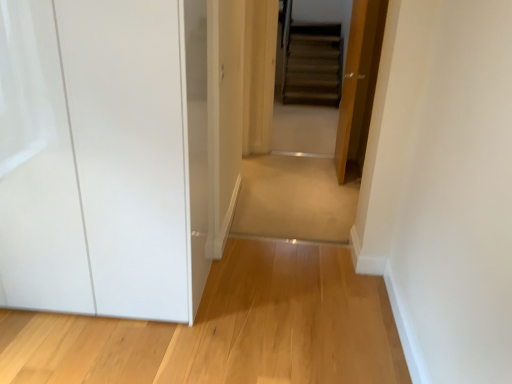
The height and width of the screenshot is (384, 512). Describe the element at coordinates (294, 199) in the screenshot. I see `beige carpet at center, positioned as the second path in front-to-back order` at that location.

The width and height of the screenshot is (512, 384). What are the coordinates of `wooden door at center` in the screenshot? It's located at (359, 86).

I want to click on door above the light wood floor at lower left, the second path viewed from the top (from a real-world perspective), so click(359, 86).

How far apart are wooden door at center and light wood floor at lower left, which is counted as the 1th path, starting from the front?

6.96 feet.

Is wooden door at center situated inside light wood floor at lower left, acting as the first path starting from the bottom, or outside?

wooden door at center is outside light wood floor at lower left, acting as the first path starting from the bottom.

What's the angular difference between wooden door at center and light wood floor at lower left, which is counted as the 1th path, starting from the front,'s facing directions?

86.2 degrees separate the facing orientations of wooden door at center and light wood floor at lower left, which is counted as the 1th path, starting from the front.

Which is more to the left, beige carpet at center, which ranks as the first path in back-to-front order, or light wood floor at lower left, acting as the first path starting from the bottom?

Positioned to the left is light wood floor at lower left, acting as the first path starting from the bottom.

Is light wood floor at lower left, the second path viewed from the top, located within beige carpet at center, which ranks as the 1th path in top-to-bottom order?

No, beige carpet at center, which ranks as the 1th path in top-to-bottom order, does not contain light wood floor at lower left, the second path viewed from the top.

Which object is closer to the camera, beige carpet at center, which is counted as the second path, starting from the bottom, or light wood floor at lower left, which is the second path in back-to-front order?

light wood floor at lower left, which is the second path in back-to-front order.

The height and width of the screenshot is (384, 512). In order to click on glass door located above the beige carpet at center, which ranks as the first path in back-to-front order (from the image's perspective) in this screenshot , I will do `click(106, 166)`.

Considering the sizes of beige carpet at center, positioned as the second path in front-to-back order, and transparent glossy cabinet at left in the image, is beige carpet at center, positioned as the second path in front-to-back order, taller or shorter than transparent glossy cabinet at left?

Considering their sizes, beige carpet at center, positioned as the second path in front-to-back order, has less height than transparent glossy cabinet at left.

From the picture: Is beige carpet at center, which is counted as the second path, starting from the bottom, far from transparent glossy cabinet at left?

beige carpet at center, which is counted as the second path, starting from the bottom, is far away from transparent glossy cabinet at left.

Does point (340, 239) appear closer or farther from the camera than point (56, 122)?

Clearly, point (340, 239) is more distant from the camera than point (56, 122).

Looking at this image, would you say light wood floor at lower left, acting as the first path starting from the bottom, contains transparent glossy cabinet at left?

Actually, transparent glossy cabinet at left is outside light wood floor at lower left, acting as the first path starting from the bottom.

In terms of size, does light wood floor at lower left, the second path viewed from the top, appear bigger or smaller than transparent glossy cabinet at left?

Clearly, light wood floor at lower left, the second path viewed from the top, is smaller in size than transparent glossy cabinet at left.

From a real-world perspective, which is physically above, beige carpet at center, positioned as the second path in front-to-back order, or wooden door at center?

wooden door at center, from a real-world perspective.

Is point (258, 169) closer or farther from the camera than point (366, 39)?

Point (258, 169) appears to be farther away from the viewer than point (366, 39).

Is beige carpet at center, which ranks as the 1th path in top-to-bottom order, at the left side of wooden door at center?

Correct, you'll find beige carpet at center, which ranks as the 1th path in top-to-bottom order, to the left of wooden door at center.

Is light wood floor at lower left, the second path viewed from the top, wider than beige carpet at center, positioned as the second path in front-to-back order?

No.

From the image's perspective, is light wood floor at lower left, which is the second path in back-to-front order, located above or below beige carpet at center, which ranks as the first path in back-to-front order?

light wood floor at lower left, which is the second path in back-to-front order, is below beige carpet at center, which ranks as the first path in back-to-front order.

Is the position of light wood floor at lower left, acting as the first path starting from the bottom, less distant than that of beige carpet at center, which is counted as the second path, starting from the bottom?

Yes, the depth of light wood floor at lower left, acting as the first path starting from the bottom, is less than that of beige carpet at center, which is counted as the second path, starting from the bottom.

Considering the sizes of objects transparent glossy cabinet at left and beige carpet at center, which ranks as the first path in back-to-front order, in the image provided, who is taller, transparent glossy cabinet at left or beige carpet at center, which ranks as the first path in back-to-front order,?

Standing taller between the two is transparent glossy cabinet at left.

In terms of size, does transparent glossy cabinet at left appear bigger or smaller than beige carpet at center, which ranks as the first path in back-to-front order?

Considering their sizes, transparent glossy cabinet at left takes up more space than beige carpet at center, which ranks as the first path in back-to-front order.

Is transparent glossy cabinet at left inside the boundaries of beige carpet at center, which ranks as the first path in back-to-front order, or outside?

transparent glossy cabinet at left cannot be found inside beige carpet at center, which ranks as the first path in back-to-front order.

Which object is positioned more to the right, transparent glossy cabinet at left or beige carpet at center, which is counted as the second path, starting from the bottom?

beige carpet at center, which is counted as the second path, starting from the bottom.

Locate an element on the screen. door lying on the right of light wood floor at lower left, which is the second path in back-to-front order is located at coordinates (359, 86).

At what (x,y) coordinates should I click in order to perform the action: click on path below the beige carpet at center, positioned as the second path in front-to-back order (from a real-world perspective). Please return your answer as a coordinate pair (x, y). This screenshot has width=512, height=384. Looking at the image, I should click on (227, 329).

Considering their positions, is wooden door at center positioned further to light wood floor at lower left, acting as the first path starting from the bottom, than beige carpet at center, positioned as the second path in front-to-back order?

Based on the image, wooden door at center appears to be further to light wood floor at lower left, acting as the first path starting from the bottom.

Which object lies further to the anchor point wooden door at center, light wood floor at lower left, which is counted as the 1th path, starting from the front, or beige carpet at center, which ranks as the first path in back-to-front order?

Based on the image, light wood floor at lower left, which is counted as the 1th path, starting from the front, appears to be further to wooden door at center.

Which object lies nearer to the anchor point beige carpet at center, which is counted as the second path, starting from the bottom, light wood floor at lower left, which is counted as the 1th path, starting from the front, or wooden door at center?

wooden door at center is positioned closer to the anchor beige carpet at center, which is counted as the second path, starting from the bottom.

Based on their spatial positions, is transparent glossy cabinet at left or beige carpet at center, positioned as the second path in front-to-back order, further from light wood floor at lower left, which is the second path in back-to-front order?

Based on the image, beige carpet at center, positioned as the second path in front-to-back order, appears to be further to light wood floor at lower left, which is the second path in back-to-front order.

Which object lies further to the anchor point transparent glossy cabinet at left, wooden door at center or beige carpet at center, which ranks as the first path in back-to-front order?

wooden door at center.

From the image, which object appears to be farther from wooden door at center, light wood floor at lower left, acting as the first path starting from the bottom, or transparent glossy cabinet at left?

The object further to wooden door at center is transparent glossy cabinet at left.

Estimate the real-world distances between objects in this image. Which object is closer to light wood floor at lower left, which is counted as the 1th path, starting from the front, wooden door at center or transparent glossy cabinet at left?

transparent glossy cabinet at left.

When comparing their distances from transparent glossy cabinet at left, does light wood floor at lower left, the second path viewed from the top, or beige carpet at center, positioned as the second path in front-to-back order, seem closer?

light wood floor at lower left, the second path viewed from the top, is closer to transparent glossy cabinet at left.

Find the location of a particular element. path situated between transparent glossy cabinet at left and beige carpet at center, which is counted as the second path, starting from the bottom, from left to right is located at coordinates (227, 329).

This screenshot has height=384, width=512. What are the coordinates of `path between light wood floor at lower left, which is counted as the 1th path, starting from the front, and wooden door at center from front to back` in the screenshot? It's located at (294, 199).